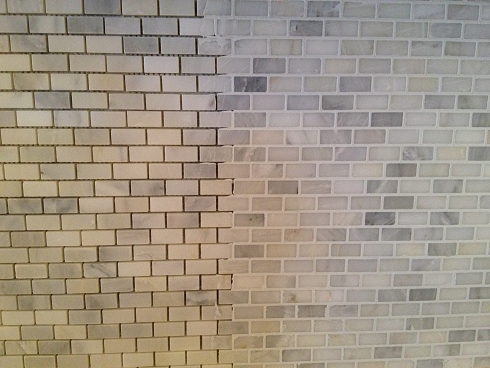
Identify the location of half white grout bricks. (216, 5), (210, 46), (224, 139), (216, 189), (231, 201), (222, 266), (230, 298), (227, 326), (219, 341), (241, 352).